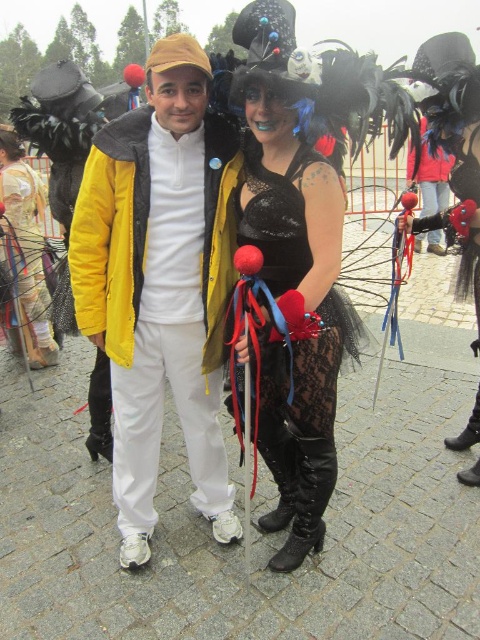
You are a photographer planning to take a group photo of the lace fabric dress at center and the matte gold dress at center. To ensure both are visible, which dress should be placed in the front?

The lace fabric dress at center is taller than the matte gold dress at center, so to ensure both are visible, the shorter matte gold dress at center should be placed in the front.